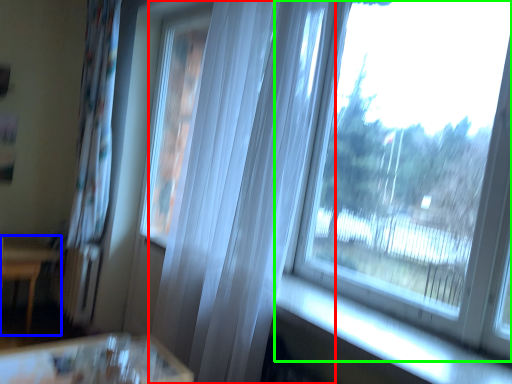
Question: Which object is the farthest from curtain (highlighted by a red box)? Choose among these: furniture (highlighted by a blue box) or window (highlighted by a green box).

Choices:
 (A) furniture
 (B) window

Answer: (A)